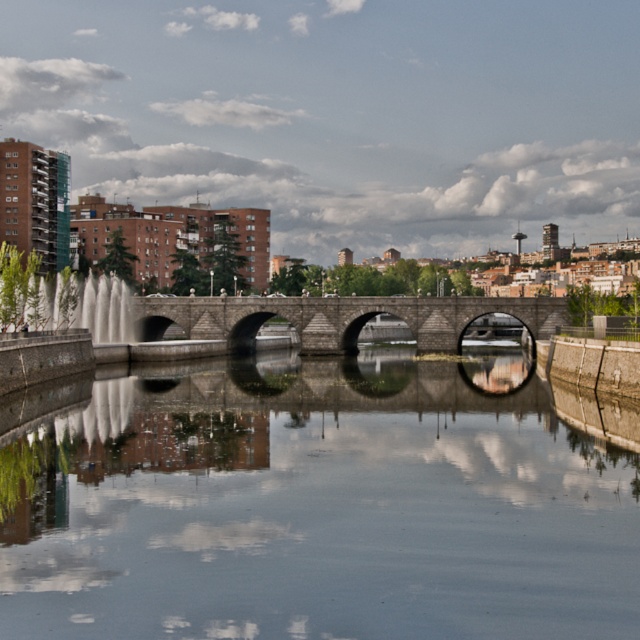
Is the position of smooth concrete water at center less distant than that of stone bridge at center?

Yes.

The height and width of the screenshot is (640, 640). What do you see at coordinates (316, 508) in the screenshot?
I see `smooth concrete water at center` at bounding box center [316, 508].

This screenshot has width=640, height=640. What do you see at coordinates (316, 508) in the screenshot?
I see `smooth concrete water at center` at bounding box center [316, 508].

Locate an element on the screen. The width and height of the screenshot is (640, 640). smooth concrete water at center is located at coordinates (316, 508).